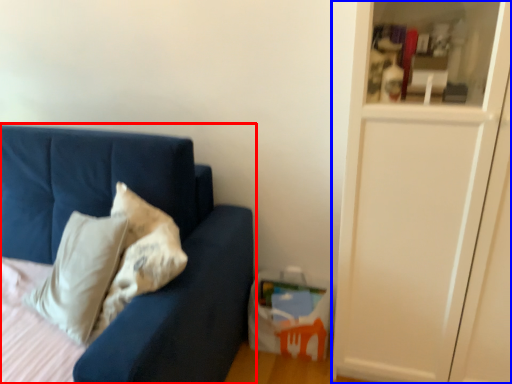
Question: Which object is closer to the camera taking this photo, studio couch (highlighted by a red box) or glass door (highlighted by a blue box)?

Choices:
 (A) studio couch
 (B) glass door

Answer: (A)